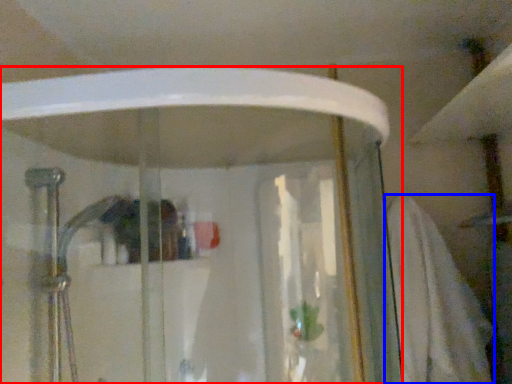
Question: Among these objects, which one is farthest to the camera, shower door (highlighted by a red box) or bath towel (highlighted by a blue box)?

Choices:
 (A) shower door
 (B) bath towel

Answer: (B)